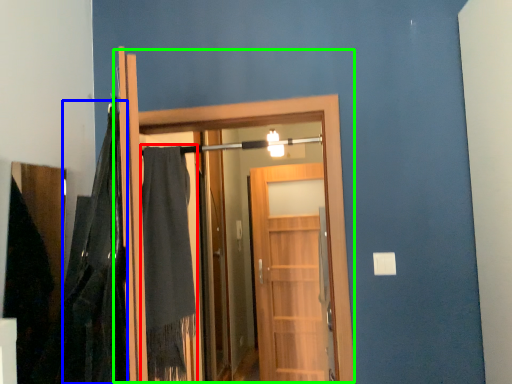
Question: Estimate the real-world distances between objects in this image. Which object is farther from robe (highlighted by a red box), blanket (highlighted by a blue box) or door (highlighted by a green box)?

Choices:
 (A) blanket
 (B) door

Answer: (A)